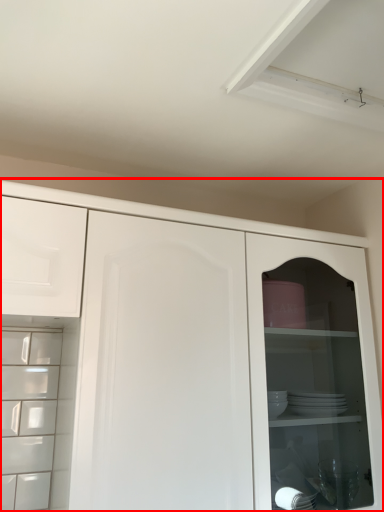
Question: From the image's perspective, what is the correct spatial relationship of cupboard (annotated by the red box) in relation to drawer?

Choices:
 (A) above
 (B) below

Answer: (B)